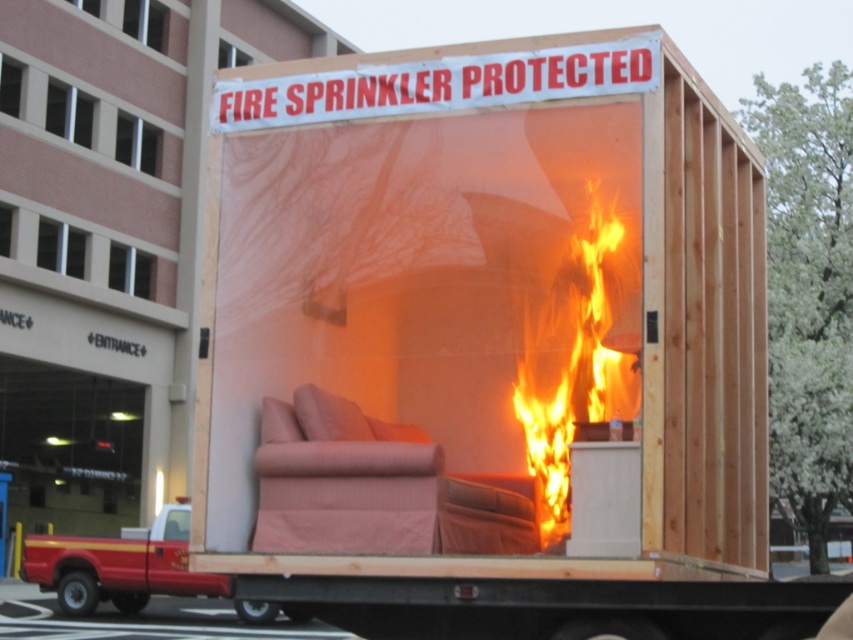
Consider the image. You are standing at the origin point in the image. Where is the pink fabric couch at center located?

The pink fabric couch at center is located at point 0.750 in the x coordinate and 0.403 in the y coordinate.

You are a safety inspector evaluating the setup. You notice the pink fabric couch at center and the flaming orange fabric at center. Which object is taller?

The flaming orange fabric at center is taller than the pink fabric couch at center.

You are standing at point (257, 452) and want to take a photo of the entire wooden structure mounted on the red pickup truck. If your camera is 6.86 meters away from you, will it capture the entire structure in one shot?

The camera is 6.86 meters away from point (257, 452), so yes, it can capture the entire wooden structure mounted on the red pickup truck in one shot since the distance is sufficient.